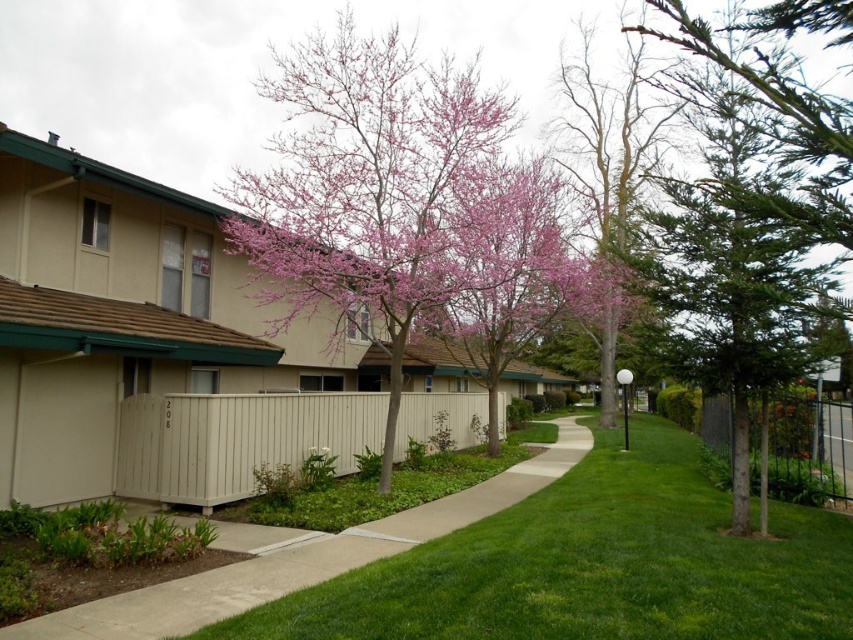
You are a gardener planning to install a new pathway. You have a limited amount of materials. Which object in the scene, the smooth concrete sidewalk at center or the metallic silver fence at right, would require more materials if you were to replicate its size?

The smooth concrete sidewalk at center requires more materials because it is larger in size than the metallic silver fence at right.

You are standing on the sidewalk in front of the townhouses and notice a pink bloom tree at center and a metallic silver fence at right. Which object is taller?

The pink bloom tree at center is taller than the metallic silver fence at right.

You are standing on the sidewalk in front of the townhouses and see both the pink bloom tree at center and the bare wood tree at center. Which tree would appear closer to you?

The pink bloom tree at center appears closer to you because it is positioned further to the viewer than the bare wood tree at center.